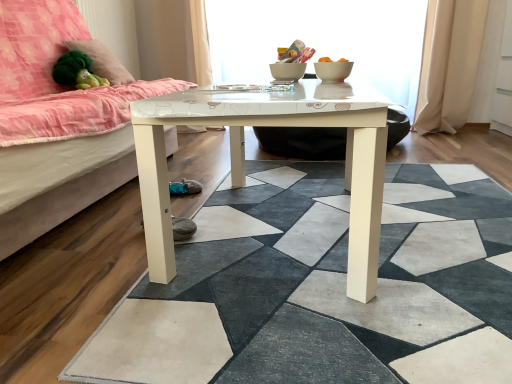
Question: Can you confirm if white glossy table at center is positioned to the right of matte pink fabric at left?

Choices:
 (A) yes
 (B) no

Answer: (A)

Question: From the image's perspective, is white glossy table at center located above matte pink fabric at left?

Choices:
 (A) no
 (B) yes

Answer: (A)

Question: Does white glossy table at center turn towards matte pink fabric at left?

Choices:
 (A) no
 (B) yes

Answer: (A)

Question: From the image's perspective, does white glossy table at center appear lower than matte pink fabric at left?

Choices:
 (A) no
 (B) yes

Answer: (B)

Question: Does white glossy table at center appear on the left side of matte pink fabric at left?

Choices:
 (A) no
 (B) yes

Answer: (A)

Question: Is white glossy table at center facing away from matte pink fabric at left?

Choices:
 (A) no
 (B) yes

Answer: (A)

Question: Is white glossy bowl at center in contact with white glossy table at center?

Choices:
 (A) yes
 (B) no

Answer: (B)

Question: Does white glossy bowl at center have a lesser height compared to white glossy table at center?

Choices:
 (A) yes
 (B) no

Answer: (A)

Question: Does white glossy bowl at center have a greater width compared to white glossy table at center?

Choices:
 (A) no
 (B) yes

Answer: (A)

Question: Is white glossy bowl at center aimed at white glossy table at center?

Choices:
 (A) no
 (B) yes

Answer: (A)

Question: Is white glossy table at center completely or partially inside white glossy bowl at center?

Choices:
 (A) yes
 (B) no

Answer: (B)

Question: Are white glossy bowl at center and white glossy table at center far apart?

Choices:
 (A) no
 (B) yes

Answer: (A)

Question: Is white glossy table at center outside of green plush at upper left?

Choices:
 (A) yes
 (B) no

Answer: (A)